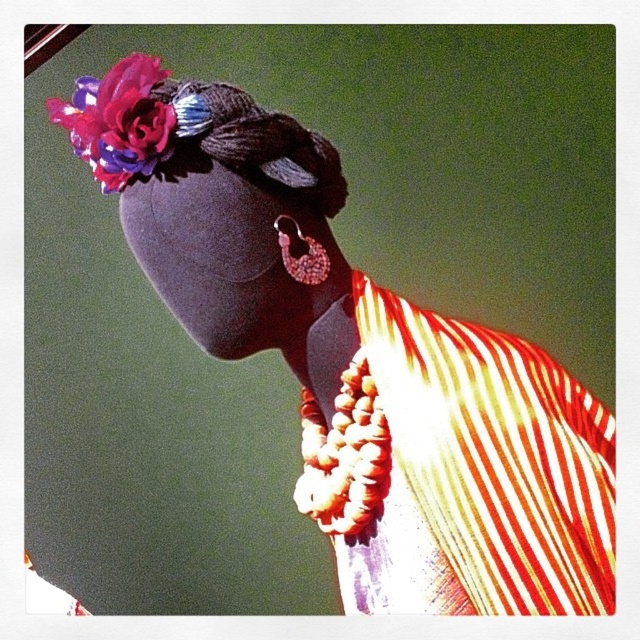
Question: Estimate the real-world distances between objects in this image. Which object is closer to the pearl-like beaded earring at center?

Choices:
 (A) velvet floral headpiece at upper left
 (B) silky satin flower at upper left
 (C) striped fabric dress at center

Answer: (A)

Question: Does striped fabric dress at center appear on the right side of pearl-like beaded earring at center?

Choices:
 (A) yes
 (B) no

Answer: (A)

Question: Which is farther from the pearl-like beaded earring at center?

Choices:
 (A) silky satin flower at upper left
 (B) velvet floral headpiece at upper left
 (C) striped fabric dress at center

Answer: (C)

Question: Which point appears closest to the camera in this image?

Choices:
 (A) (285, 268)
 (B) (72, 131)
 (C) (205, 148)
 (D) (310, 454)

Answer: (C)

Question: Does striped fabric dress at center come behind pearl-like beaded earring at center?

Choices:
 (A) no
 (B) yes

Answer: (A)

Question: Can you confirm if striped fabric dress at center is bigger than pearl-like beaded earring at center?

Choices:
 (A) yes
 (B) no

Answer: (A)